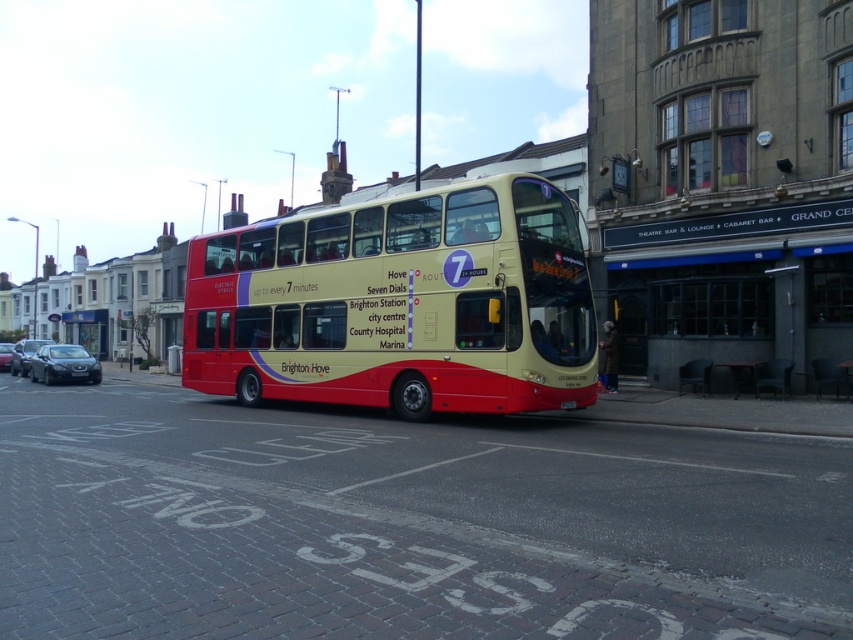
Question: Can you confirm if metallic silver car at left is wider than red plastic license plate at center?

Choices:
 (A) yes
 (B) no

Answer: (A)

Question: Based on their relative distances, which object is nearer to the red plastic license plate at center?

Choices:
 (A) satin black sedan at left
 (B) shiny black sedan at center

Answer: (A)

Question: From the image, what is the correct spatial relationship of matte red bus at center in relation to red plastic license plate at center?

Choices:
 (A) right
 (B) left

Answer: (B)

Question: Which of the following is the closest to the observer?

Choices:
 (A) matte red bus at center
 (B) metallic silver car at left

Answer: (A)

Question: Considering the relative positions of satin black sedan at left and metallic silver car at left in the image provided, where is satin black sedan at left located with respect to metallic silver car at left?

Choices:
 (A) below
 (B) above

Answer: (A)

Question: Which of the following is the closest to the observer?

Choices:
 (A) red plastic license plate at center
 (B) satin black sedan at left

Answer: (A)